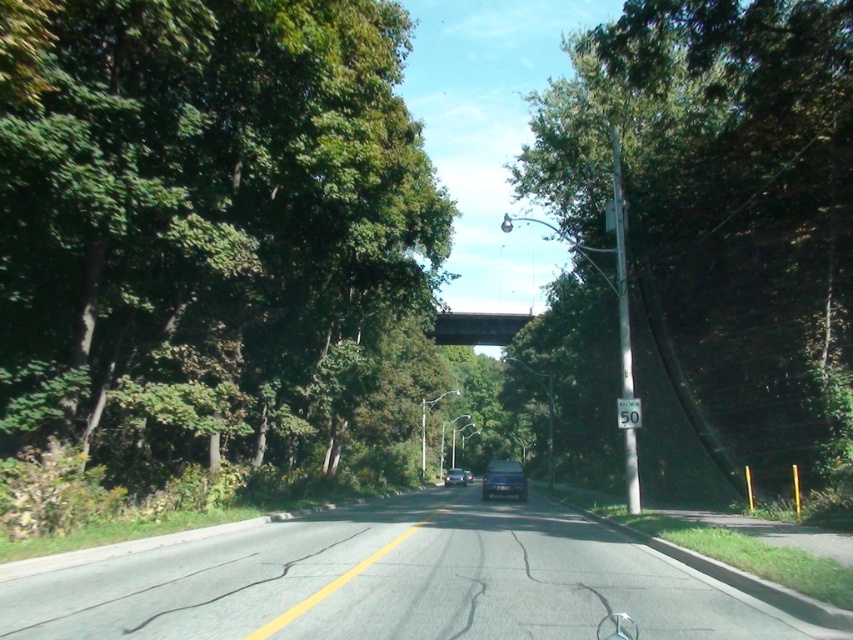
Question: Is asphalt road at center bigger than white plastic speed limit sign at center?

Choices:
 (A) yes
 (B) no

Answer: (A)

Question: Which object is the farthest from the concrete bridge at center?

Choices:
 (A) green metallic pole at right
 (B) green leafy tree at right

Answer: (A)

Question: Is satin black car at center closer to the viewer compared to white plastic speed limit sign at center?

Choices:
 (A) no
 (B) yes

Answer: (A)

Question: Which of the following is the farthest from the observer?

Choices:
 (A) (631, 412)
 (B) (502, 328)
 (C) (621, 323)

Answer: (B)

Question: Does green leafy tree at left lie in front of green leafy tree at right?

Choices:
 (A) no
 (B) yes

Answer: (B)

Question: Which point is closer to the camera?

Choices:
 (A) (659, 72)
 (B) (619, 337)
 (C) (511, 323)

Answer: (A)